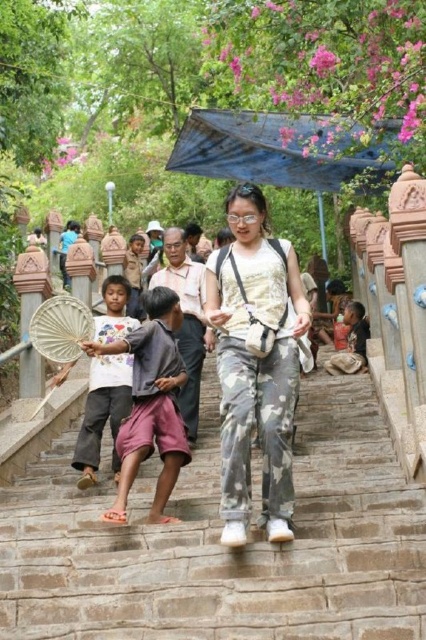
You are standing on the stone stairs at center and want to take a photo of the camo pants at center. Which object is closer to your camera lens?

The stone stairs at center is closer to the viewer than the camo pants at center, so the camera lens would capture the stone stairs at center first, making it appear closer in the photo.

You are standing on the stone staircase and see the camo pants at center and the brown cotton shirt at lower right. Which one is closer to your left side?

The camo pants at center is closer to your left side because it is positioned to the left of the brown cotton shirt at lower right.

You are standing at the bottom of the stone staircase surrounded by greenery and pink flowers. You see a woman wearing camo pants at center. Where exactly is the camo pants located in terms of coordinates?

The camo pants at center is located at coordinates point (256, 364).